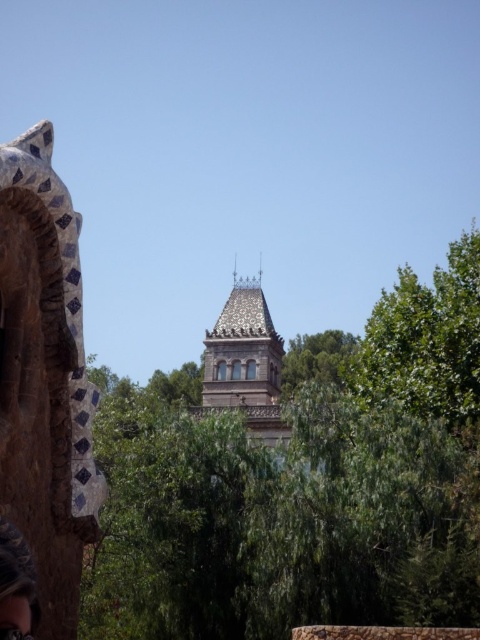
Which is more to the left, polished stone tower at center or matte black hair at lower left?

matte black hair at lower left is more to the left.

Is polished stone tower at center wider than matte black hair at lower left?

Yes.

Does point (283, 353) come behind point (16, 593)?

Yes.

Identify the location of polished stone tower at center. This screenshot has width=480, height=640. (244, 362).

Is green leafy tree at center smaller than polychrome mosaic dragon head at left?

Actually, green leafy tree at center might be larger than polychrome mosaic dragon head at left.

Describe the element at coordinates (302, 484) in the screenshot. I see `green leafy tree at center` at that location.

You are a GUI agent. You are given a task and a screenshot of the screen. Output one action in this format:
    pyautogui.click(x=<x>, y=<y>)
    Task: Click on the green leafy tree at center
    
    Given the screenshot: What is the action you would take?
    pyautogui.click(x=302, y=484)

The image size is (480, 640). What do you see at coordinates (302, 484) in the screenshot?
I see `green leafy tree at center` at bounding box center [302, 484].

Is point (336, 604) more distant than point (11, 564)?

That is True.

Locate an element on the screen. Image resolution: width=480 pixels, height=640 pixels. green leafy tree at center is located at coordinates (302, 484).